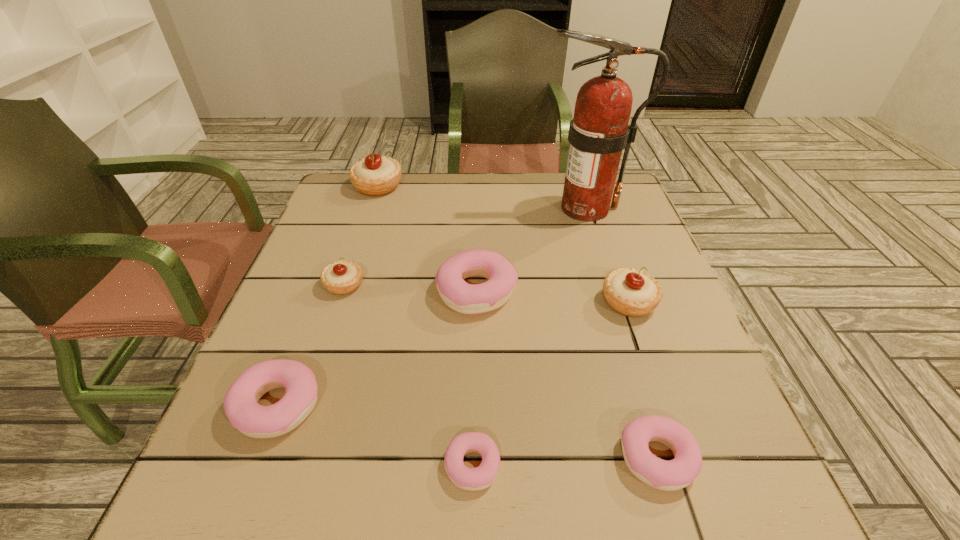
Where is `red fire extinguisher`? The image size is (960, 540). red fire extinguisher is located at coordinates (599, 131).

Image resolution: width=960 pixels, height=540 pixels. In order to click on the tallest object in this screenshot , I will do `click(599, 131)`.

Where is `the tallest pastry`? Image resolution: width=960 pixels, height=540 pixels. the tallest pastry is located at coordinates (373, 176).

I want to click on the biggest beige pastry, so click(x=373, y=176).

Where is `the second biggest beige pastry`? the second biggest beige pastry is located at coordinates (631, 292).

Locate an element on the screen. This screenshot has height=540, width=960. the third tallest object is located at coordinates (631, 292).

Find the location of a particular element. the smallest beige pastry is located at coordinates (340, 278).

Where is `the farthest pink pastry`? This screenshot has width=960, height=540. the farthest pink pastry is located at coordinates (465, 298).

Find the location of a particular element. This screenshot has height=540, width=960. the leftmost pink pastry is located at coordinates (241, 406).

Find the location of a particular element. This screenshot has height=540, width=960. the second biggest pink pastry is located at coordinates (241, 406).